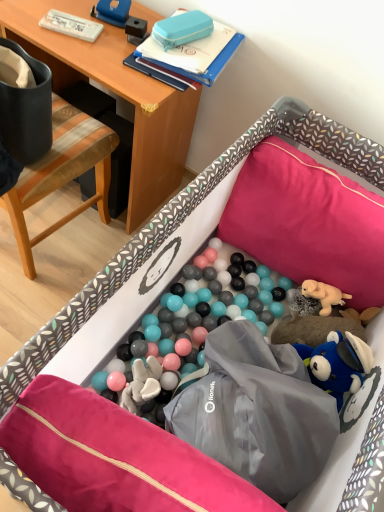
Question: Does blue hard plastic case at upper center have a greater height compared to woodenchair at left?

Choices:
 (A) no
 (B) yes

Answer: (A)

Question: From the image's perspective, is blue hard plastic case at upper center below woodenchair at left?

Choices:
 (A) no
 (B) yes

Answer: (A)

Question: Can you confirm if blue hard plastic case at upper center is smaller than woodenchair at left?

Choices:
 (A) no
 (B) yes

Answer: (B)

Question: From a real-world perspective, is blue hard plastic case at upper center beneath woodenchair at left?

Choices:
 (A) yes
 (B) no

Answer: (B)

Question: Considering the relative sizes of blue hard plastic case at upper center and woodenchair at left in the image provided, is blue hard plastic case at upper center bigger than woodenchair at left?

Choices:
 (A) yes
 (B) no

Answer: (B)

Question: Could you tell me if blue hard plastic case at upper center is facing woodenchair at left?

Choices:
 (A) no
 (B) yes

Answer: (B)

Question: Could blue hard plastic case at upper center be considered to be inside wooden desk at upper left?

Choices:
 (A) yes
 (B) no

Answer: (B)

Question: Is wooden desk at upper left turned away from blue hard plastic case at upper center?

Choices:
 (A) no
 (B) yes

Answer: (A)

Question: Does wooden desk at upper left have a greater height compared to blue hard plastic case at upper center?

Choices:
 (A) yes
 (B) no

Answer: (A)

Question: Does wooden desk at upper left have a larger size compared to blue hard plastic case at upper center?

Choices:
 (A) yes
 (B) no

Answer: (A)

Question: Does wooden desk at upper left touch blue hard plastic case at upper center?

Choices:
 (A) no
 (B) yes

Answer: (A)

Question: Is wooden desk at upper left shorter than blue hard plastic case at upper center?

Choices:
 (A) yes
 (B) no

Answer: (B)

Question: Does pink fabric pillow at center, which appears as the 2th pillow when viewed from the back, appear on the right side of woodenchair at left?

Choices:
 (A) no
 (B) yes

Answer: (B)